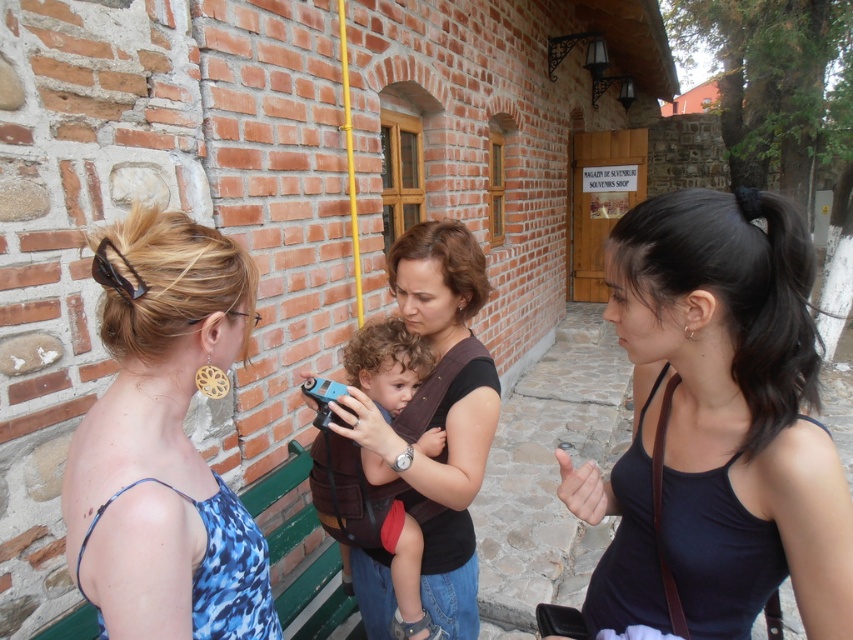
Which is behind, point (664, 451) or point (350, 380)?

Point (350, 380)

Which is more to the left, black fabric tank top at center or blue plastic toy car at center?

blue plastic toy car at center is more to the left.

Locate an element on the screen. black fabric tank top at center is located at coordinates (718, 422).

Can you confirm if blue printed dress at center is wider than blue plastic toy car at center?

No.

Consider the image. Is blue printed dress at center in front of blue plastic toy car at center?

Yes, it is.

Which is in front, point (204, 529) or point (376, 396)?

Positioned in front is point (204, 529).

Identify the location of blue printed dress at center. The image size is (853, 640). (164, 442).

Is black fabric tank top at center positioned before blue printed dress at center?

No, it is not.

Is black fabric tank top at center positioned behind blue printed dress at center?

Yes, black fabric tank top at center is behind blue printed dress at center.

Identify the location of black fabric tank top at center. (718, 422).